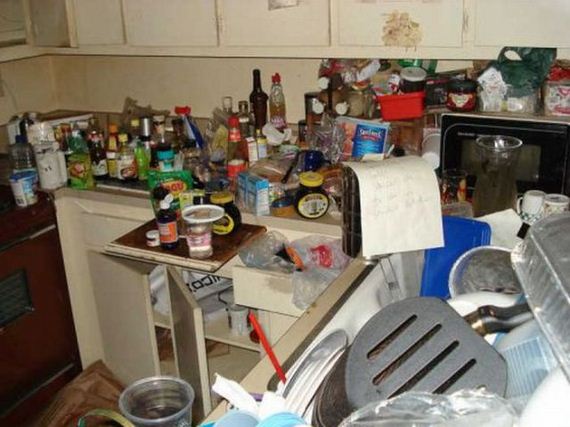
Where is `cabinet door`? This screenshot has height=427, width=570. cabinet door is located at coordinates (191, 337).